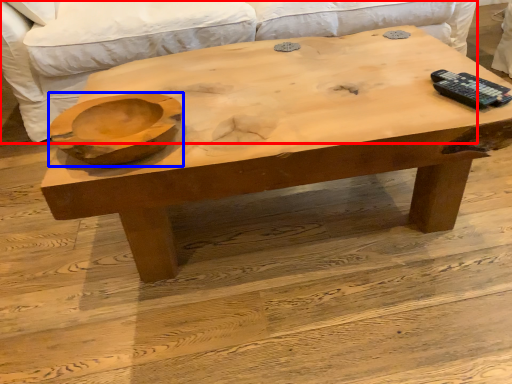
Question: Which object appears closest to the camera in this image, couch (highlighted by a red box) or bowl (highlighted by a blue box)?

Choices:
 (A) couch
 (B) bowl

Answer: (B)